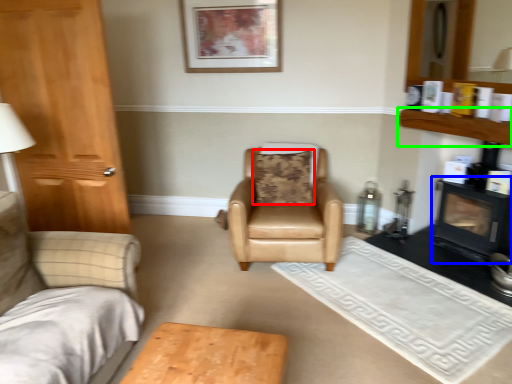
Question: Which object is positioned closest to pillow (highlighted by a red box)? Select from fireplace (highlighted by a blue box) and shelf (highlighted by a green box).

Choices:
 (A) fireplace
 (B) shelf

Answer: (B)